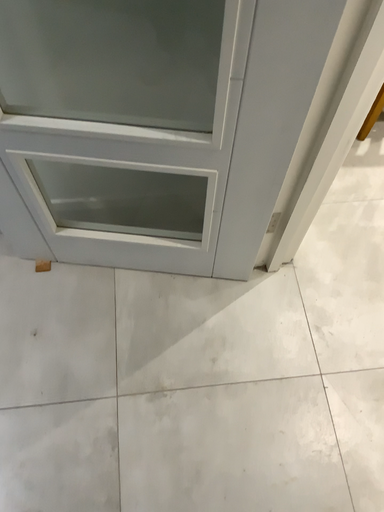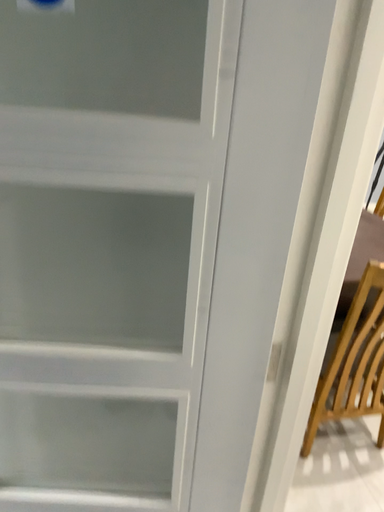
Question: Which way did the camera rotate in the video?

Choices:
 (A) rotated upward
 (B) rotated downward

Answer: (A)